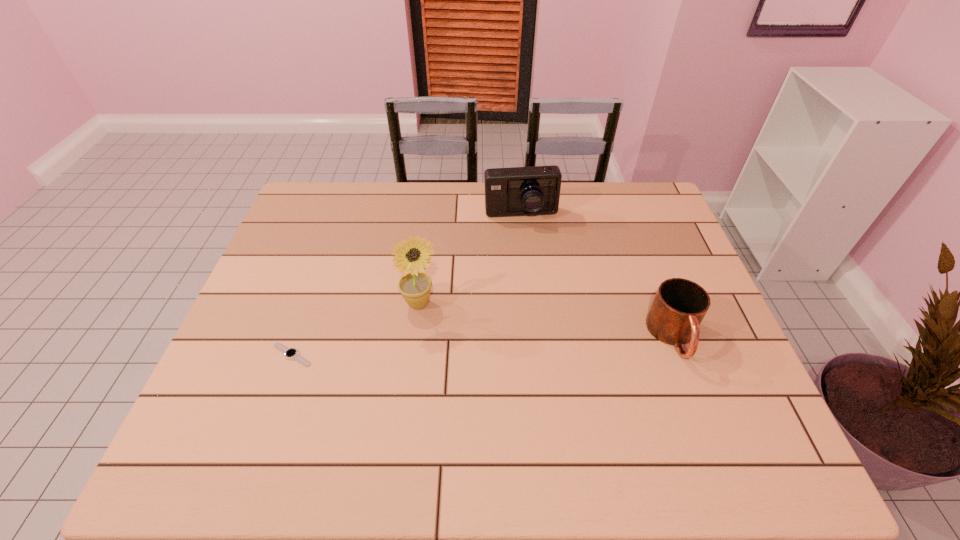
Locate an element on the screen. The width and height of the screenshot is (960, 540). vacant space on the desktop that is between the leftmost object and the rightmost object and is positioned on the front-facing side of the farthest object is located at coordinates (539, 343).

At what (x,y) coordinates should I click in order to perform the action: click on free space on the desktop that is between the leftmost object and the third tallest object and is positioned on the face of the sunflower. Please return your answer as a coordinate pair (x, y). Image resolution: width=960 pixels, height=540 pixels. Looking at the image, I should click on (x=498, y=345).